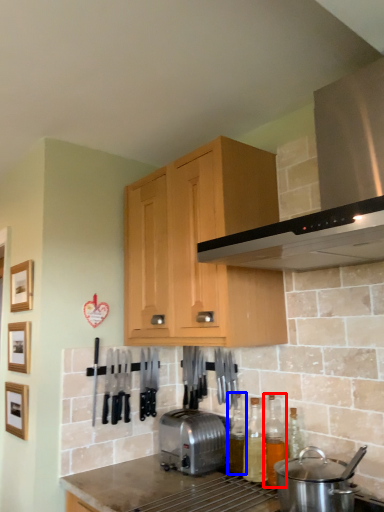
Question: Among these objects, which one is farthest to the camera, bottle (highlighted by a red box) or bottle (highlighted by a blue box)?

Choices:
 (A) bottle
 (B) bottle

Answer: (B)